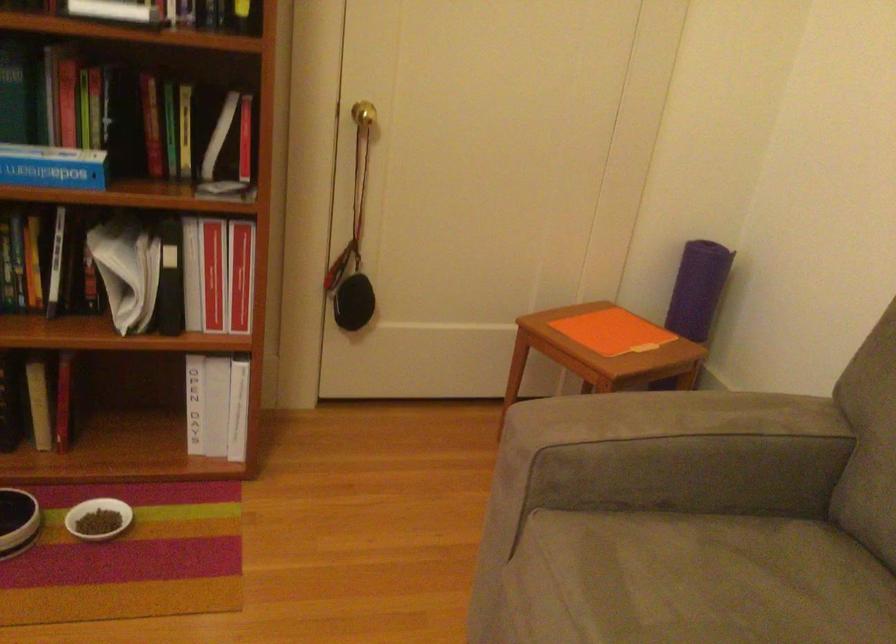
Where is `blue soda stream box`? blue soda stream box is located at coordinates (53, 167).